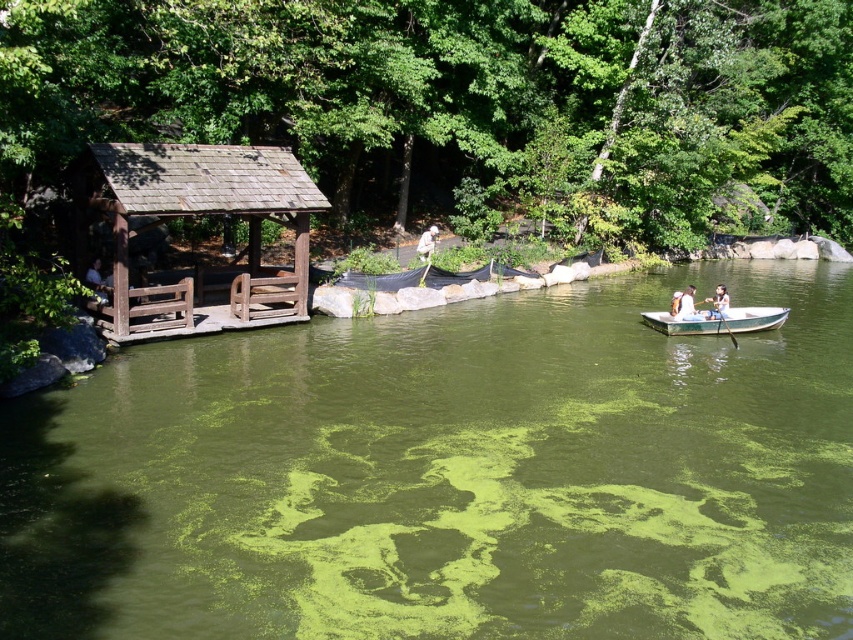
What do you see at coordinates (206, 212) in the screenshot?
I see `brown wooden gazebo at left` at bounding box center [206, 212].

Can you confirm if brown wooden gazebo at left is positioned to the right of wooden boat at right?

Incorrect, brown wooden gazebo at left is not on the right side of wooden boat at right.

I want to click on brown wooden gazebo at left, so click(206, 212).

The width and height of the screenshot is (853, 640). Identify the location of brown wooden gazebo at left. (206, 212).

Can you confirm if green algae-covered water at center is shorter than brown wooden gazebo at left?

No, green algae-covered water at center is not shorter than brown wooden gazebo at left.

Does green algae-covered water at center appear on the right side of brown wooden gazebo at left?

Correct, you'll find green algae-covered water at center to the right of brown wooden gazebo at left.

Is point (352, 401) behind point (143, 316)?

No, it is in front of (143, 316).

Where is `green algae-covered water at center`? The image size is (853, 640). green algae-covered water at center is located at coordinates (450, 476).

Is point (726, 308) positioned before point (428, 250)?

That is True.

Is wooden canoe at right to the right of white fur dog at center from the viewer's perspective?

Correct, you'll find wooden canoe at right to the right of white fur dog at center.

Is point (776, 316) closer to camera compared to point (428, 253)?

Yes, it is.

The image size is (853, 640). Find the location of `wooden canoe at right`. wooden canoe at right is located at coordinates (718, 321).